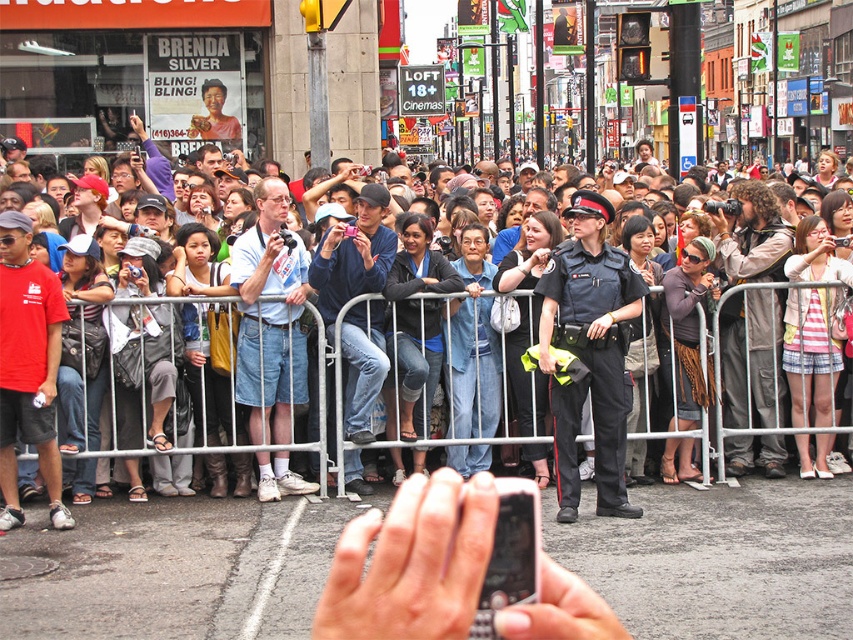
Can you confirm if striped fabric skirt at center is positioned above matte black uniform at center?

Yes.

Is point (831, 244) positioned in front of point (103, 435)?

No, (831, 244) is further to viewer.

You are a GUI agent. You are given a task and a screenshot of the screen. Output one action in this format:
    pyautogui.click(x=<x>, y=<y>)
    Task: Click on the striped fabric skirt at center
    This screenshot has height=640, width=853.
    Given the screenshot: What is the action you would take?
    pyautogui.click(x=810, y=355)